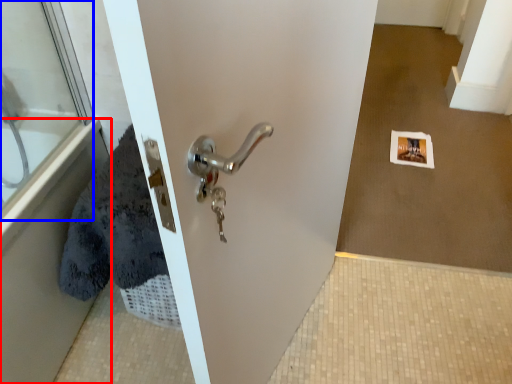
Question: Which of the following is the closest to the observer, bath (highlighted by a red box) or glass door (highlighted by a blue box)?

Choices:
 (A) bath
 (B) glass door

Answer: (A)